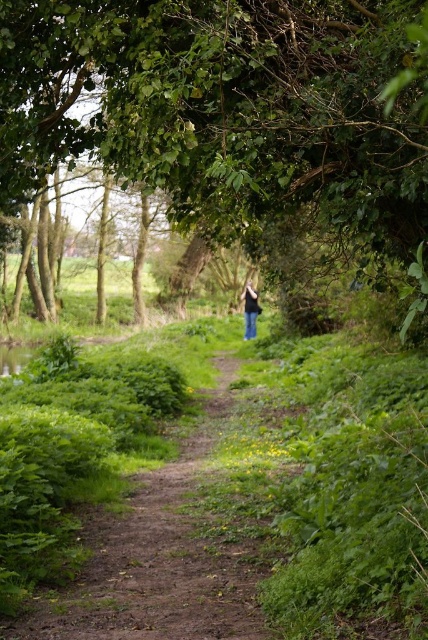
Question: Where is green leafy tree at center located in relation to denim jeans at center in the image?

Choices:
 (A) left
 (B) right

Answer: (A)

Question: Where is green leafy tree at center located in relation to denim jeans at center in the image?

Choices:
 (A) left
 (B) right

Answer: (A)

Question: Can you confirm if green leafy tree at center is bigger than dirt path at center?

Choices:
 (A) yes
 (B) no

Answer: (A)

Question: Which point appears farthest from the camera in this image?

Choices:
 (A) (398, 13)
 (B) (243, 314)
 (C) (163, 554)

Answer: (B)

Question: Which point is closer to the camera?

Choices:
 (A) green leafy tree at center
 (B) denim jeans at center

Answer: (A)

Question: Which object appears farthest from the camera in this image?

Choices:
 (A) denim jeans at center
 (B) dirt path at center

Answer: (A)